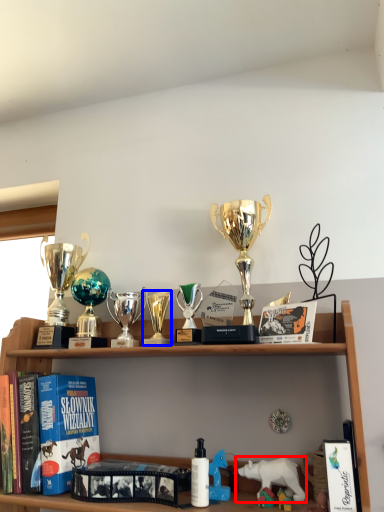
Question: Which object appears farthest to the camera in this image, animal (highlighted by a red box) or toy (highlighted by a blue box)?

Choices:
 (A) animal
 (B) toy

Answer: (B)